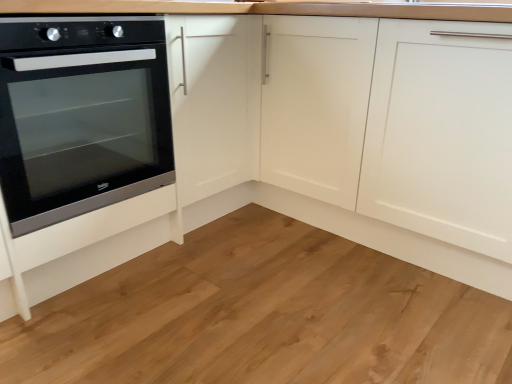
Question: Is black glass oven at left taller or shorter than natural wood flooring at lower left?

Choices:
 (A) short
 (B) tall

Answer: (B)

Question: Based on their sizes in the image, would you say black glass oven at left is bigger or smaller than natural wood flooring at lower left?

Choices:
 (A) small
 (B) big

Answer: (B)

Question: Considering the positions of black glass oven at left and natural wood flooring at lower left in the image, is black glass oven at left wider or thinner than natural wood flooring at lower left?

Choices:
 (A) thin
 (B) wide

Answer: (A)

Question: In the image, is natural wood flooring at lower left on the left side or the right side of black glass oven at left?

Choices:
 (A) left
 (B) right

Answer: (B)

Question: From the image's perspective, relative to black glass oven at left, is natural wood flooring at lower left above or below?

Choices:
 (A) above
 (B) below

Answer: (B)

Question: Considering the positions of natural wood flooring at lower left and black glass oven at left in the image, is natural wood flooring at lower left bigger or smaller than black glass oven at left?

Choices:
 (A) big
 (B) small

Answer: (B)

Question: Is natural wood flooring at lower left taller or shorter than black glass oven at left?

Choices:
 (A) short
 (B) tall

Answer: (A)